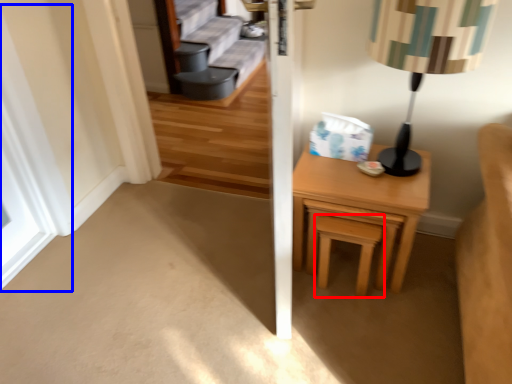
Question: Which object appears farthest to the camera in this image, stool (highlighted by a red box) or window (highlighted by a blue box)?

Choices:
 (A) stool
 (B) window

Answer: (A)